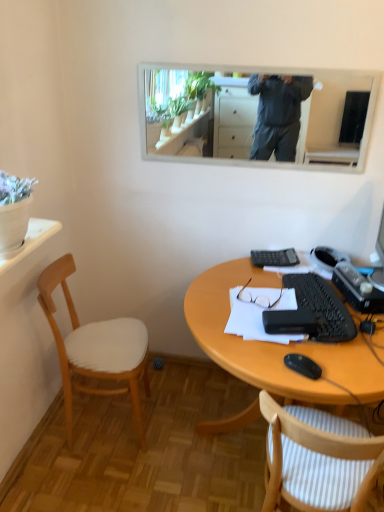
Find the location of a particular element. The image size is (384, 512). free spot in front of white paper at center is located at coordinates (293, 369).